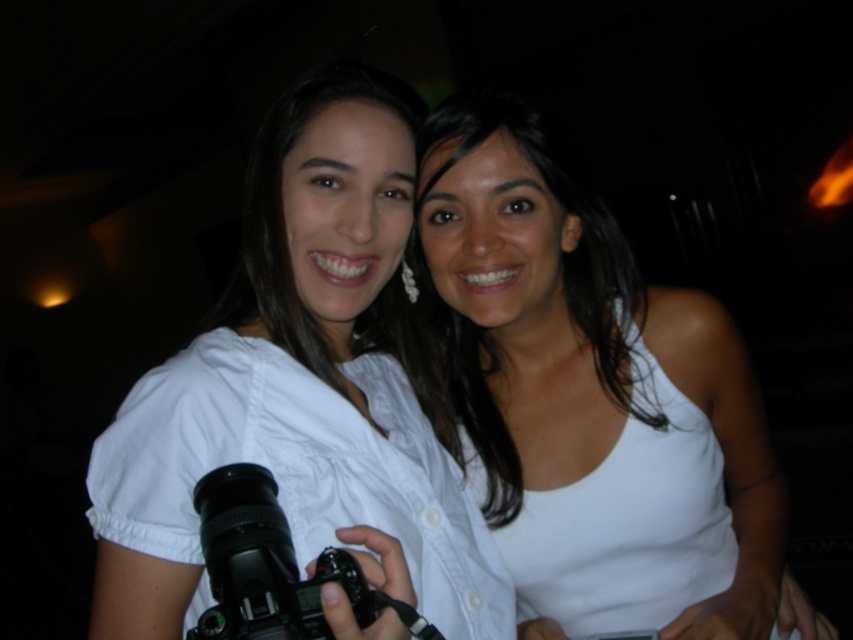
You are a photographer trying to capture a closeup of the white matte tank top at center and the black plastic camera at center in the image. Since you want to focus on both objects equally, which one should you adjust your camera to prioritize focusing on first, considering their sizes?

The white matte tank top at center is taller than the black plastic camera at center, so you should prioritize focusing on the white matte tank top at center first to ensure it fills the frame appropriately before adjusting for the smaller camera.